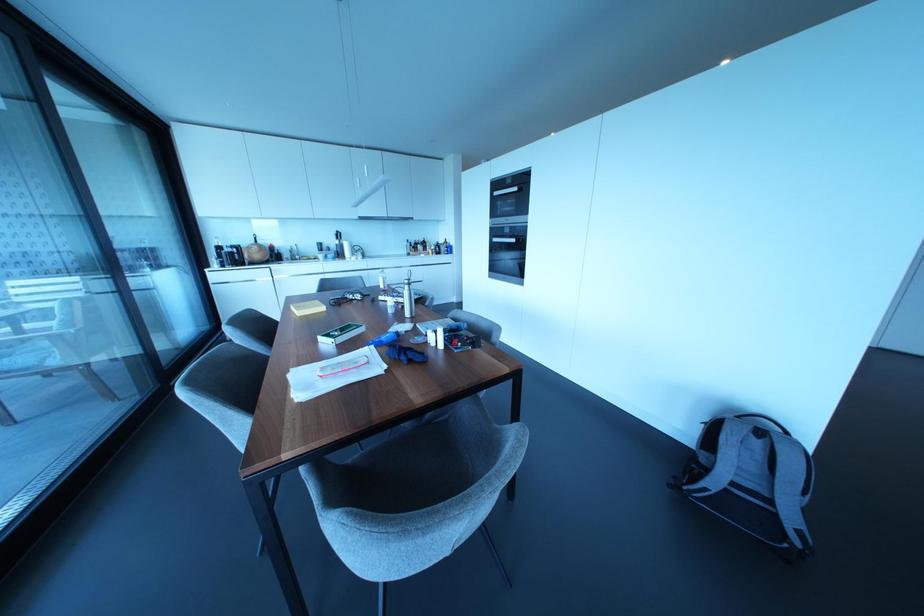
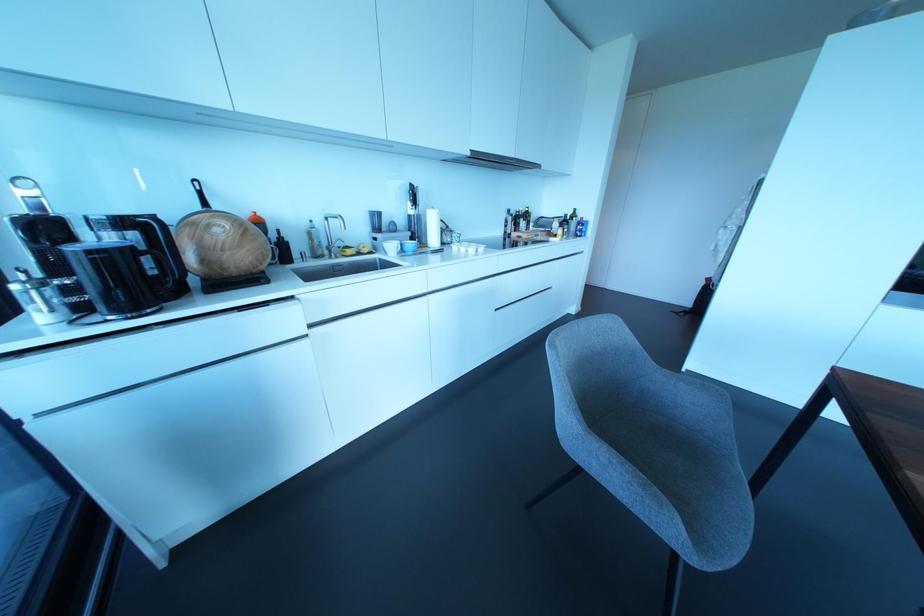
The point at (336, 241) is marked in the first image. Where is the corresponding point in the second image?

(410, 211)